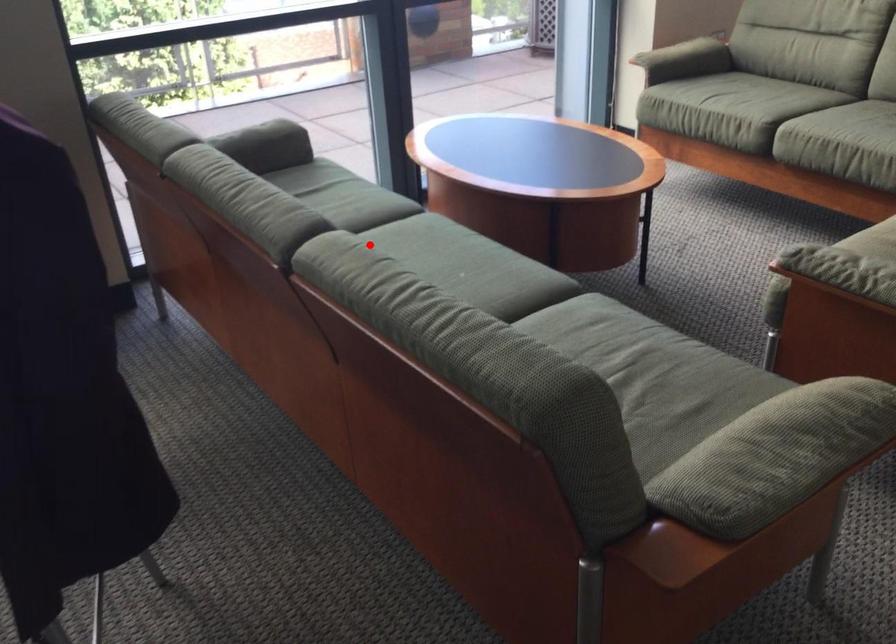
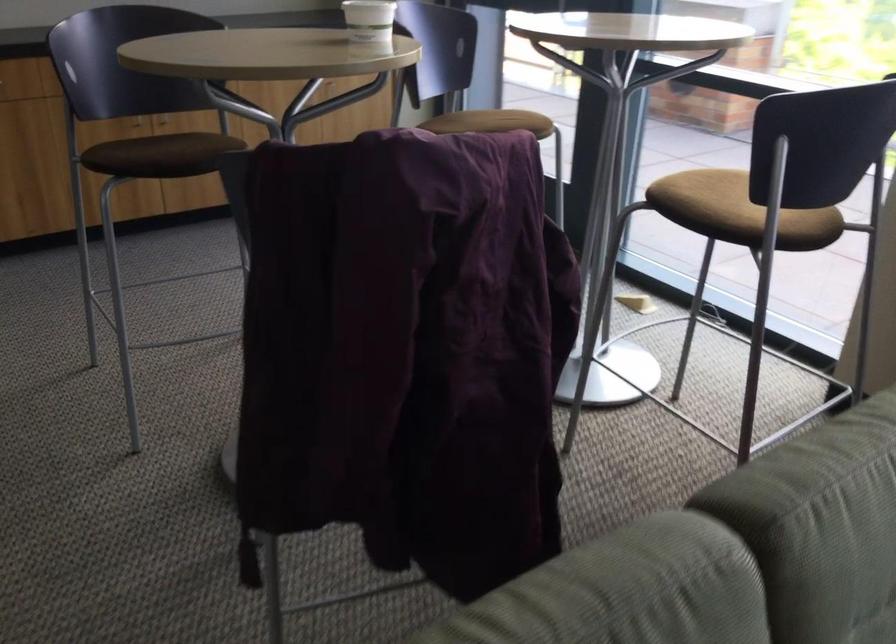
Question: I am providing you with two images of the same scene from different viewpoints. Image1 has a red point marked. In image2, the corresponding 3D location appears at what relative position? Reply with the corresponding letter.

Choices:
 (A) Closer
 (B) Farther

Answer: (A)